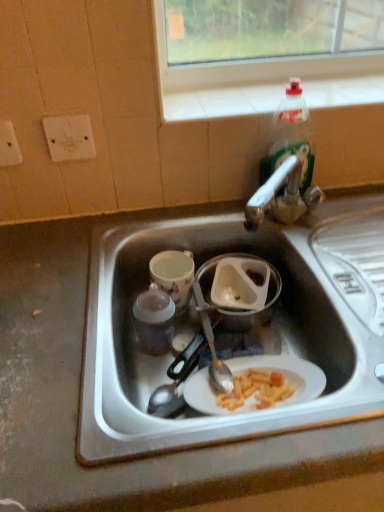
Locate an element on the screen. This screenshot has width=384, height=512. clear plastic bottle at upper right is located at coordinates pos(290,137).

Describe the element at coordinates (174, 276) in the screenshot. I see `porcelain cup at center-left` at that location.

I want to click on clear plastic bottle at upper right, so click(x=290, y=137).

Would you say porcelain cup at center-left is outside white plastic container at center?

porcelain cup at center-left is positioned outside white plastic container at center.

Measure the distance from porcelain cup at center-left to white plastic container at center.

porcelain cup at center-left and white plastic container at center are 3.91 inches apart from each other.

Does porcelain cup at center-left turn towards white plastic container at center?

No, porcelain cup at center-left does not turn towards white plastic container at center.

Based on the photo, is white plastic container at center oriented away from white matte sink at center?

Yes, white plastic container at center is positioned with its back facing white matte sink at center.

From the image's perspective, would you say white plastic container at center is shown under white matte sink at center?

No.

In terms of height, does white plastic container at center look taller or shorter compared to white matte sink at center?

Considering their sizes, white plastic container at center has less height than white matte sink at center.

Does point (227, 288) come farther from viewer compared to point (267, 224)?

Yes, it is.

I want to click on bottle above the porcelain cup at center-left (from the image's perspective), so click(x=290, y=137).

Is clear plastic bottle at upper right completely or partially outside of porcelain cup at center-left?

That's correct, clear plastic bottle at upper right is outside of porcelain cup at center-left.

How far apart are clear plastic bottle at upper right and porcelain cup at center-left?

A distance of 11.99 inches exists between clear plastic bottle at upper right and porcelain cup at center-left.

Which object is thinner, clear plastic bottle at upper right or porcelain cup at center-left?

clear plastic bottle at upper right.

The width and height of the screenshot is (384, 512). What are the coordinates of `sink on the right side of porcelain cup at center-left` in the screenshot? It's located at (261, 331).

From a real-world perspective, is porcelain cup at center-left located higher than white matte sink at center?

Incorrect, from a real-world perspective, porcelain cup at center-left is lower than white matte sink at center.

From the image's perspective, between porcelain cup at center-left and white matte sink at center, which one is located above?

porcelain cup at center-left.

Looking at this image, which is more to the left, porcelain cup at center-left or white matte sink at center?

porcelain cup at center-left.

In the scene shown: Considering the relative sizes of white matte sink at center and clear plastic bottle at upper right in the image provided, is white matte sink at center wider than clear plastic bottle at upper right?

Correct, the width of white matte sink at center exceeds that of clear plastic bottle at upper right.

Is white matte sink at center far away from clear plastic bottle at upper right?

white matte sink at center is near clear plastic bottle at upper right, not far away.

From the picture: From a real-world perspective, which is physically below, white matte sink at center or clear plastic bottle at upper right?

white matte sink at center is physically lower.

Considering their positions, is porcelain cup at center-left located in front of or behind clear plastic bottle at upper right?

In the image, porcelain cup at center-left appears behind clear plastic bottle at upper right.

From a real-world perspective, which is physically above, porcelain cup at center-left or clear plastic bottle at upper right?

clear plastic bottle at upper right.

Is porcelain cup at center-left not close to clear plastic bottle at upper right?

porcelain cup at center-left is actually quite close to clear plastic bottle at upper right.

How much distance is there between porcelain cup at center-left and clear plastic bottle at upper right?

11.99 inches.

Is white plastic container at center positioned with its back to porcelain cup at center-left?

No, white plastic container at center is not facing the opposite direction of porcelain cup at center-left.

Based on the photo, from a real-world perspective, is white plastic container at center located beneath porcelain cup at center-left?

Yes, from a real-world perspective, white plastic container at center is beneath porcelain cup at center-left.

Measure the distance between white plastic container at center and porcelain cup at center-left.

3.91 inches.

Is white plastic container at center touching porcelain cup at center-left?

Yes.

Image resolution: width=384 pixels, height=512 pixels. In order to click on coffee cup positioned vertically above the white plastic container at center (from a real-world perspective) in this screenshot , I will do point(174,276).

You are a GUI agent. You are given a task and a screenshot of the screen. Output one action in this format:
    pyautogui.click(x=<x>, y=<y>)
    Task: Click on the appliance on the right of white matte sink at center
    The width and height of the screenshot is (384, 512).
    Given the screenshot: What is the action you would take?
    pyautogui.click(x=240, y=289)

When comparing their distances from porcelain cup at center-left, does clear plastic bottle at upper right or white plastic container at center seem further?

Among the two, clear plastic bottle at upper right is located further to porcelain cup at center-left.

Looking at the image, which one is located closer to white matte sink at center, white plastic container at center or clear plastic bottle at upper right?

Among the two, white plastic container at center is located nearer to white matte sink at center.

Based on their spatial positions, is white plastic container at center or white matte sink at center further from porcelain cup at center-left?

Among the two, white matte sink at center is located further to porcelain cup at center-left.

Based on their spatial positions, is porcelain cup at center-left or white plastic container at center further from clear plastic bottle at upper right?

porcelain cup at center-left is positioned further to the anchor clear plastic bottle at upper right.

Looking at this image, estimate the real-world distances between objects in this image. Which object is closer to porcelain cup at center-left, clear plastic bottle at upper right or white matte sink at center?

white matte sink at center lies closer to porcelain cup at center-left than the other object.

From the image, which object appears to be farther from porcelain cup at center-left, white matte sink at center or white plastic container at center?

white matte sink at center lies further to porcelain cup at center-left than the other object.

Based on their spatial positions, is white matte sink at center or clear plastic bottle at upper right closer to white plastic container at center?

The object closer to white plastic container at center is white matte sink at center.

Looking at the image, which one is located closer to porcelain cup at center-left, white matte sink at center or clear plastic bottle at upper right?

white matte sink at center.

I want to click on coffee cup that lies between clear plastic bottle at upper right and white plastic container at center from top to bottom, so click(174, 276).

Identify the location of coffee cup between white matte sink at center and white plastic container at center in the front-back direction. (174, 276).

Where is `appliance that lies between clear plastic bottle at upper right and white matte sink at center from top to bottom`? This screenshot has height=512, width=384. appliance that lies between clear plastic bottle at upper right and white matte sink at center from top to bottom is located at coordinates click(240, 289).

Identify the location of coffee cup between clear plastic bottle at upper right and white matte sink at center vertically. (174, 276).